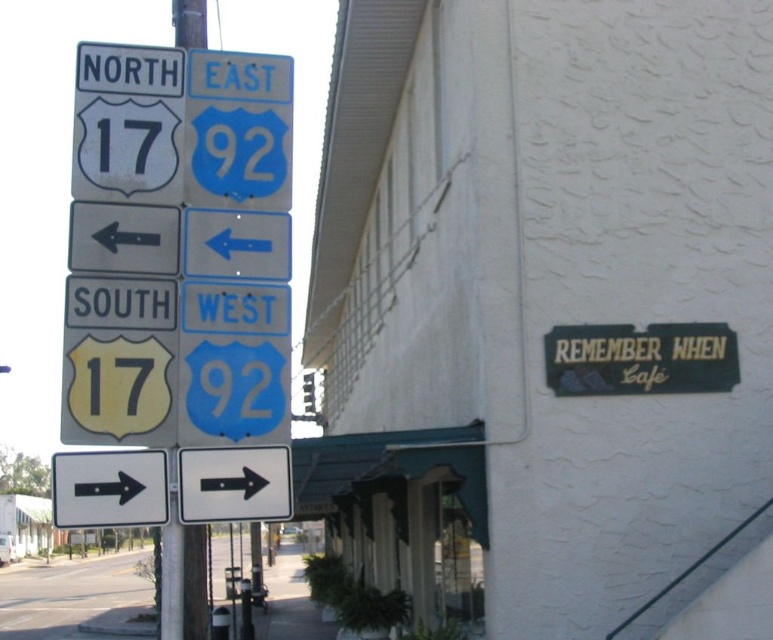
Question: Is metallic pole at left positioned before yellow matte sign at left?

Choices:
 (A) no
 (B) yes

Answer: (B)

Question: Which of the following is the farthest from the observer?

Choices:
 (A) (172, 10)
 (B) (100, 154)

Answer: (A)

Question: Is metallic pole at left positioned before yellow matte sign at left?

Choices:
 (A) no
 (B) yes

Answer: (B)

Question: Is metallic pole at left to the right of yellow matte sign at left from the viewer's perspective?

Choices:
 (A) yes
 (B) no

Answer: (B)

Question: Which of the following is the closest to the observer?

Choices:
 (A) metallic pole at left
 (B) yellow matte sign at left

Answer: (A)